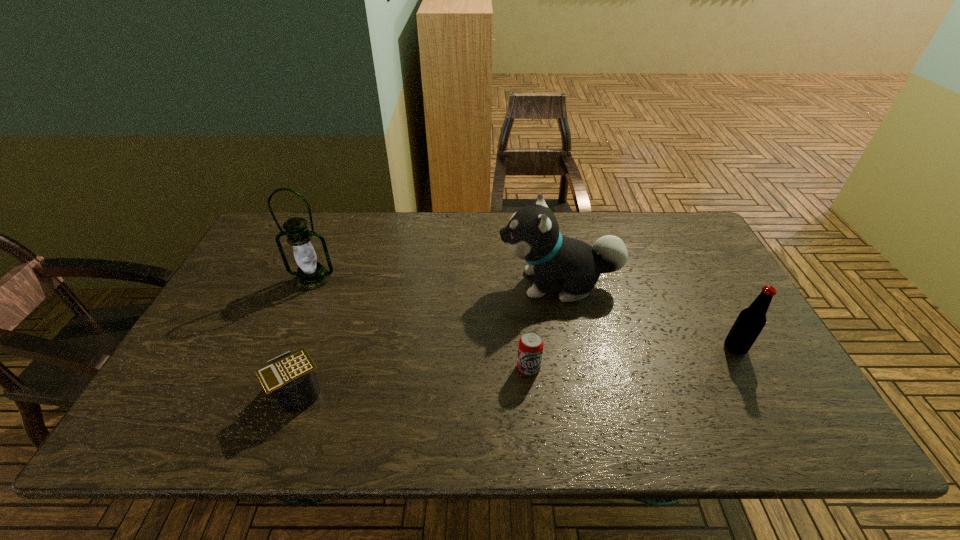
This screenshot has height=540, width=960. I want to click on vacant region located 0.060m on the left of the rightmost object, so tap(700, 348).

The image size is (960, 540). I want to click on free space located on the surface of the soda can, so click(533, 411).

Where is `vacant area situated on the back of the calculator`? vacant area situated on the back of the calculator is located at coordinates (346, 262).

The image size is (960, 540). In order to click on object positioned at the near edge in this screenshot , I will do `click(290, 376)`.

Where is `object situated at the right edge`? The width and height of the screenshot is (960, 540). object situated at the right edge is located at coordinates (750, 322).

The width and height of the screenshot is (960, 540). I want to click on free space at the far edge of the desktop, so click(502, 251).

Where is `free space at the near edge of the desktop`? free space at the near edge of the desktop is located at coordinates (711, 418).

You are a GUI agent. You are given a task and a screenshot of the screen. Output one action in this format:
    pyautogui.click(x=<x>, y=<y>)
    Task: Click on the free space at the left edge of the desktop
    Image resolution: width=960 pixels, height=540 pixels.
    Given the screenshot: What is the action you would take?
    point(205,373)

In the image, there is a desktop. Identify the location of free space at the right edge. (780, 400).

Locate an element on the screen. This screenshot has width=960, height=540. free space at the far left corner of the desktop is located at coordinates (281, 240).